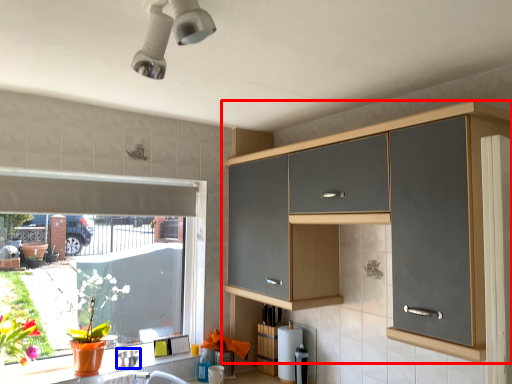
Question: Which point is closer to the camera, cabinetry (highlighted by a red box) or appliance (highlighted by a blue box)?

Choices:
 (A) cabinetry
 (B) appliance

Answer: (A)